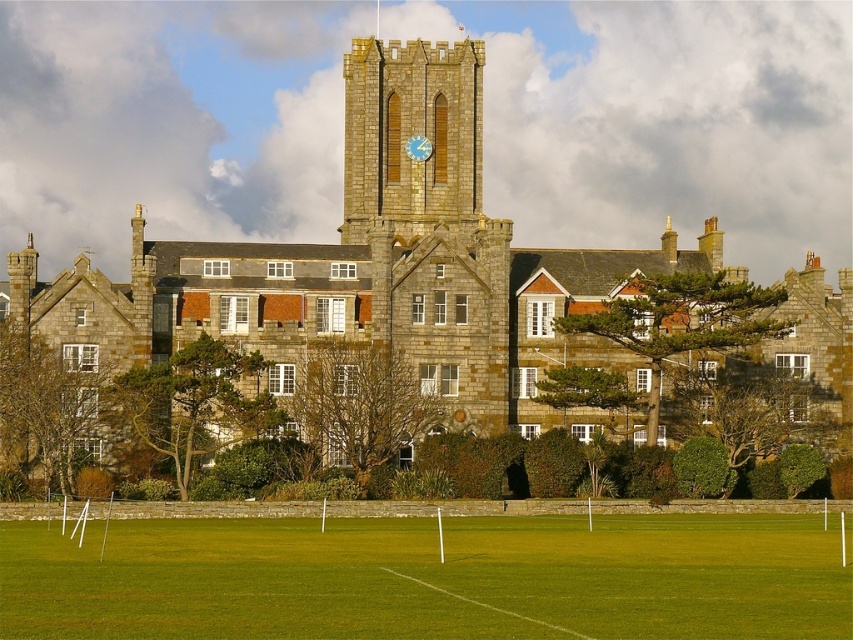
Is stone clock tower at center positioned at the back of blue wooden clock at center?

No, it is not.

You are a GUI agent. You are given a task and a screenshot of the screen. Output one action in this format:
    pyautogui.click(x=<x>, y=<y>)
    Task: Click on the stone clock tower at center
    The image size is (853, 640).
    Given the screenshot: What is the action you would take?
    coord(410,134)

Can you confirm if brown stone church at center is bigger than blue wooden clock at center?

Indeed, brown stone church at center has a larger size compared to blue wooden clock at center.

Is brown stone church at center to the right of blue wooden clock at center from the viewer's perspective?

Yes, brown stone church at center is to the right of blue wooden clock at center.

What are the coordinates of `brown stone church at center` in the screenshot? It's located at (408, 275).

You are a GUI agent. You are given a task and a screenshot of the screen. Output one action in this format:
    pyautogui.click(x=<x>, y=<y>)
    Task: Click on the brown stone church at center
    Image resolution: width=853 pixels, height=640 pixels.
    Given the screenshot: What is the action you would take?
    pyautogui.click(x=408, y=275)

You are a GUI agent. You are given a task and a screenshot of the screen. Output one action in this format:
    pyautogui.click(x=<x>, y=<y>)
    Task: Click on the green grass football field at lower center
    The height and width of the screenshot is (640, 853).
    Given the screenshot: What is the action you would take?
    pyautogui.click(x=428, y=579)

Is green grass football field at lower center to the left of stone clock tower at center from the viewer's perspective?

No, green grass football field at lower center is not to the left of stone clock tower at center.

Which is in front, point (820, 536) or point (445, 144)?

Positioned in front is point (820, 536).

The height and width of the screenshot is (640, 853). Find the location of `green grass football field at lower center`. green grass football field at lower center is located at coordinates [428, 579].